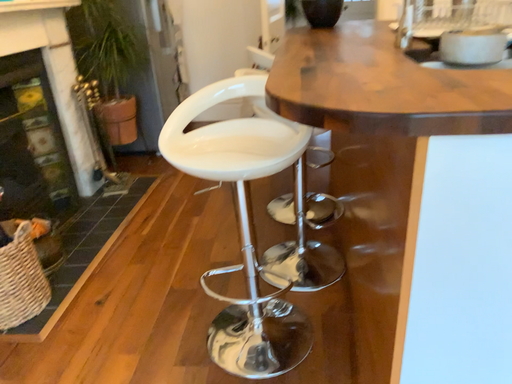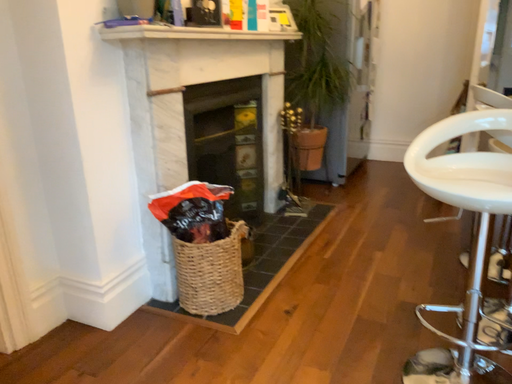
Question: How did the camera likely rotate when shooting the video?

Choices:
 (A) rotated downward
 (B) rotated upward

Answer: (B)